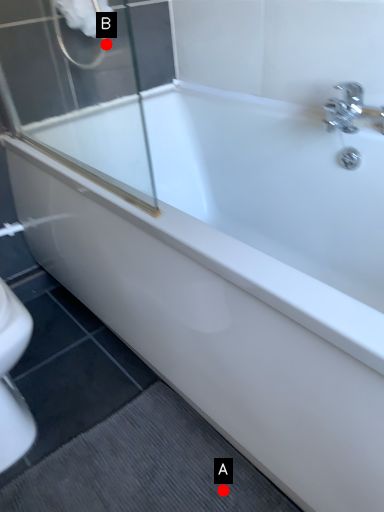
Question: Two points are circled on the image, labeled by A and B beside each circle. Which of the following is the closest to the observer?

Choices:
 (A) A is closer
 (B) B is closer

Answer: (A)